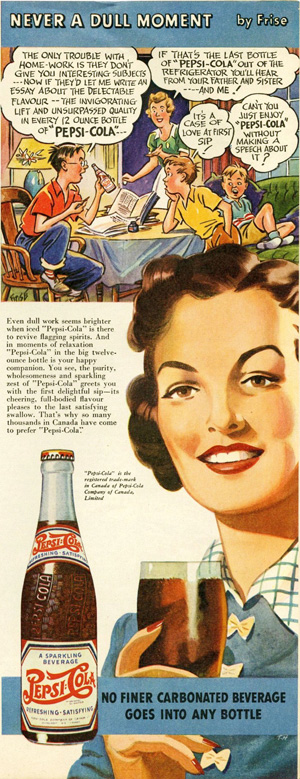
Identify the location of wooden chair. The width and height of the screenshot is (300, 779). (9, 189).